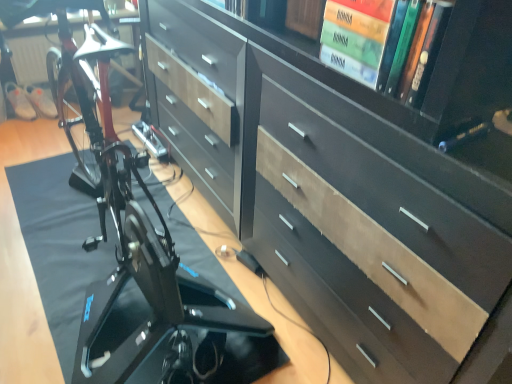
Locate an element on the screen. Image resolution: width=512 pixels, height=384 pixels. black glossy bicycle at lower left is located at coordinates (133, 239).

The height and width of the screenshot is (384, 512). What do you see at coordinates (133, 239) in the screenshot? I see `black glossy bicycle at lower left` at bounding box center [133, 239].

What is the approximate height of black glossy bicycle at lower left?

4.97 centimeters.

Describe the element at coordinates (351, 181) in the screenshot. The height and width of the screenshot is (384, 512). I see `dark wood chest of drawers at center` at that location.

Where is `dark wood chest of drawers at center`? The height and width of the screenshot is (384, 512). dark wood chest of drawers at center is located at coordinates coord(351,181).

The width and height of the screenshot is (512, 384). I want to click on black glossy bicycle at lower left, so click(x=133, y=239).

Is dark wood chest of drawers at center to the left of black glossy bicycle at lower left from the viewer's perspective?

No.

In the scene shown: Considering the positions of objects dark wood chest of drawers at center and black glossy bicycle at lower left in the image provided, who is behind, dark wood chest of drawers at center or black glossy bicycle at lower left?

black glossy bicycle at lower left is further from the camera.

Which is farther, [401,169] or [146,351]?

The point [146,351] is farther.

From the image's perspective, which object appears higher, dark wood chest of drawers at center or black glossy bicycle at lower left?

dark wood chest of drawers at center appears higher in the image.

From a real-world perspective, is dark wood chest of drawers at center over black glossy bicycle at lower left?

Yes.

Considering the sizes of objects dark wood chest of drawers at center and black glossy bicycle at lower left in the image provided, who is thinner, dark wood chest of drawers at center or black glossy bicycle at lower left?

dark wood chest of drawers at center.

Is dark wood chest of drawers at center taller than black glossy bicycle at lower left?

Correct, dark wood chest of drawers at center is much taller as black glossy bicycle at lower left.

Who is bigger, dark wood chest of drawers at center or black glossy bicycle at lower left?

Bigger between the two is dark wood chest of drawers at center.

Is dark wood chest of drawers at center not within black glossy bicycle at lower left?

Yes, dark wood chest of drawers at center is outside of black glossy bicycle at lower left.

Is there a large distance between dark wood chest of drawers at center and black glossy bicycle at lower left?

dark wood chest of drawers at center is near black glossy bicycle at lower left, not far away.

Is dark wood chest of drawers at center looking in the opposite direction of black glossy bicycle at lower left?

dark wood chest of drawers at center is not turned away from black glossy bicycle at lower left.

Locate an element on the screen. the chest of drawers located above the black glossy bicycle at lower left (from a real-world perspective) is located at coordinates (351, 181).

Can you confirm if black glossy bicycle at lower left is positioned to the right of dark wood chest of drawers at center?

No, black glossy bicycle at lower left is not to the right of dark wood chest of drawers at center.

Which object is closer to the camera, black glossy bicycle at lower left or dark wood chest of drawers at center?

Positioned in front is dark wood chest of drawers at center.

Which point is more forward, (85, 332) or (403, 317)?

The point (403, 317) is closer to the camera.

From the image's perspective, is black glossy bicycle at lower left on top of dark wood chest of drawers at center?

Incorrect, from the image's perspective, black glossy bicycle at lower left is lower than dark wood chest of drawers at center.

From a real-world perspective, which is physically above, black glossy bicycle at lower left or dark wood chest of drawers at center?

From a 3D spatial view, dark wood chest of drawers at center is above.

Considering the relative sizes of black glossy bicycle at lower left and dark wood chest of drawers at center in the image provided, is black glossy bicycle at lower left thinner than dark wood chest of drawers at center?

Incorrect, the width of black glossy bicycle at lower left is not less than that of dark wood chest of drawers at center.

Considering the relative sizes of black glossy bicycle at lower left and dark wood chest of drawers at center in the image provided, is black glossy bicycle at lower left shorter than dark wood chest of drawers at center?

Indeed, black glossy bicycle at lower left has a lesser height compared to dark wood chest of drawers at center.

Considering the relative sizes of black glossy bicycle at lower left and dark wood chest of drawers at center in the image provided, is black glossy bicycle at lower left smaller than dark wood chest of drawers at center?

Yes, black glossy bicycle at lower left is smaller than dark wood chest of drawers at center.

Is dark wood chest of drawers at center a part of black glossy bicycle at lower left?

Definitely not — dark wood chest of drawers at center is not inside black glossy bicycle at lower left.

Is black glossy bicycle at lower left not near dark wood chest of drawers at center?

Actually, black glossy bicycle at lower left and dark wood chest of drawers at center are a little close together.

Is dark wood chest of drawers at center at the back of black glossy bicycle at lower left?

No.

Based on the photo, what's the angular difference between black glossy bicycle at lower left and dark wood chest of drawers at center's facing directions?

A: The facing directions of black glossy bicycle at lower left and dark wood chest of drawers at center are 90.8 degrees apart.

This screenshot has width=512, height=384. Identify the location of the chest of drawers lying in front of the black glossy bicycle at lower left. (351, 181).

Find the location of `chest of drawers on the right of the black glossy bicycle at lower left`. chest of drawers on the right of the black glossy bicycle at lower left is located at coordinates (351, 181).

The height and width of the screenshot is (384, 512). I want to click on bicycle located on the left of dark wood chest of drawers at center, so click(x=133, y=239).